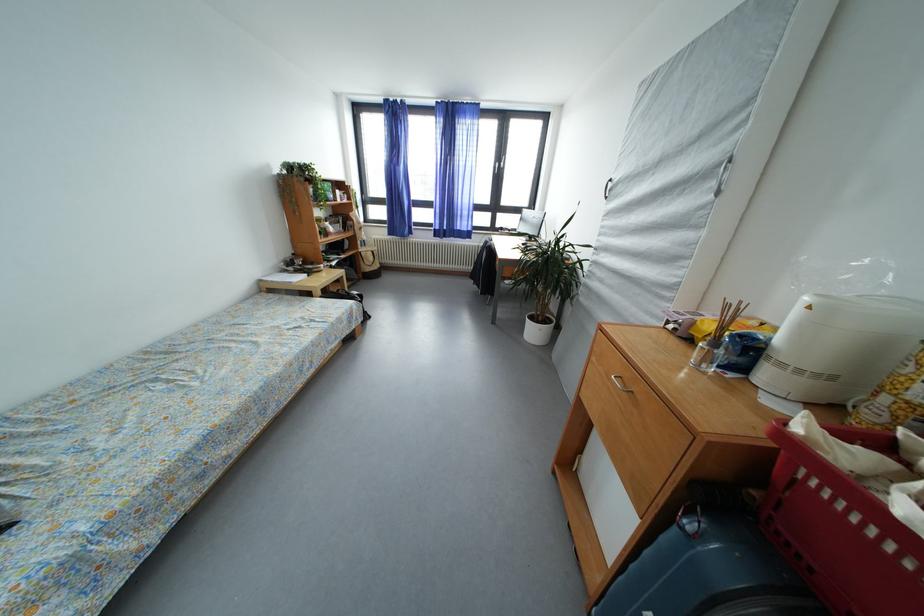
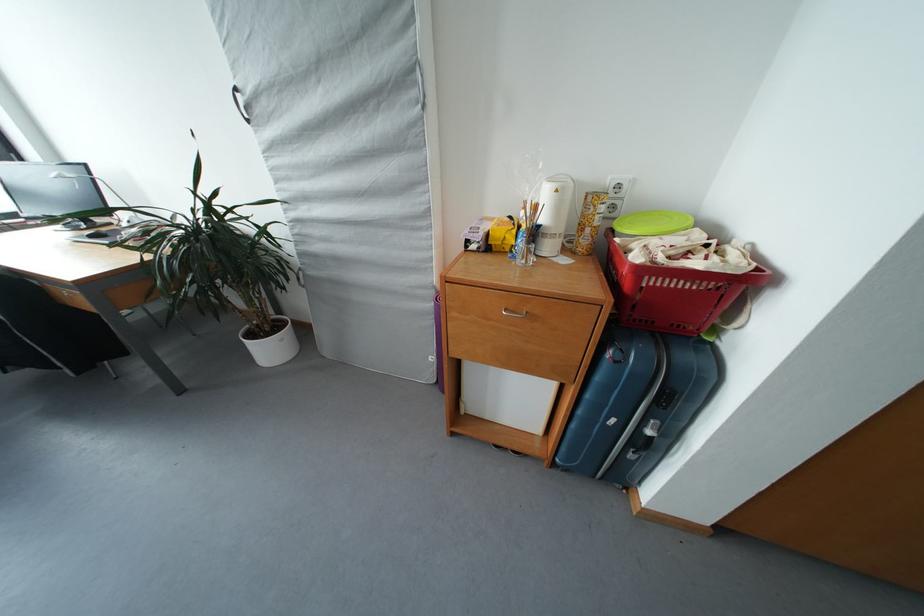
The images are taken continuously from a first-person perspective. In which direction is your viewpoint rotating?

The rotation direction of the camera is right-down.